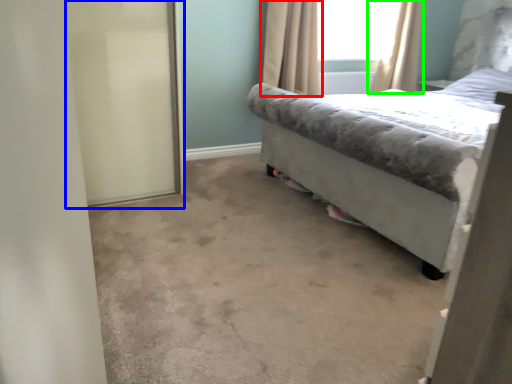
Question: Which object is the closest to the curtain (highlighted by a red box)? Choose among these: screen door (highlighted by a blue box) or curtain (highlighted by a green box).

Choices:
 (A) screen door
 (B) curtain

Answer: (B)